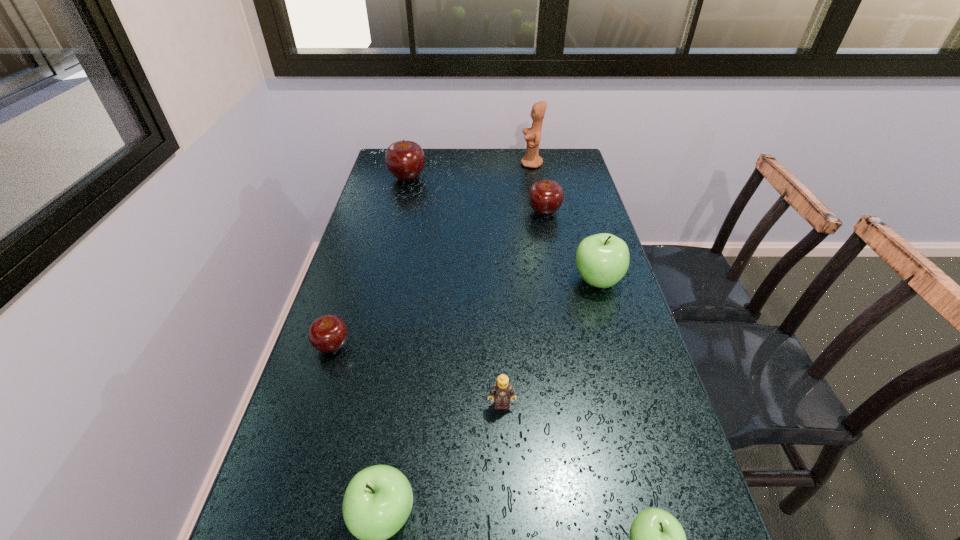
Find the location of `the third nearest apple`. the third nearest apple is located at coordinates (328, 333).

Where is `free space located 0.070m on the front-facing side of the tallest object`? This screenshot has height=540, width=960. free space located 0.070m on the front-facing side of the tallest object is located at coordinates (503, 164).

The height and width of the screenshot is (540, 960). I want to click on free space located 0.350m on the front-facing side of the tallest object, so click(x=431, y=164).

The image size is (960, 540). Identify the location of vacant space located 0.200m on the front-facing side of the tallest object. pos(469,164).

You are a GUI agent. You are given a task and a screenshot of the screen. Output one action in this format:
    pyautogui.click(x=<x>, y=<y>)
    Task: Click on the blank space located on the back of the farthest red apple
    Image resolution: width=960 pixels, height=540 pixels.
    Given the screenshot: What is the action you would take?
    pyautogui.click(x=413, y=155)

The image size is (960, 540). Identify the location of vacant area located on the left of the fourth nearest apple. (542, 281).

Locate an element on the screen. The height and width of the screenshot is (540, 960). vacant region located 0.310m on the left of the third farthest object is located at coordinates (434, 212).

Find the location of a particular element. vacant space located in front of the third nearest object is located at coordinates (503, 451).

Find the location of `free space located 0.350m on the right of the third nearest apple`. free space located 0.350m on the right of the third nearest apple is located at coordinates (498, 346).

You are a GUI agent. You are given a task and a screenshot of the screen. Output one action in this format:
    pyautogui.click(x=<x>, y=<y>)
    Task: Click on the figurine that is at the far edge
    
    Given the screenshot: What is the action you would take?
    pyautogui.click(x=531, y=159)